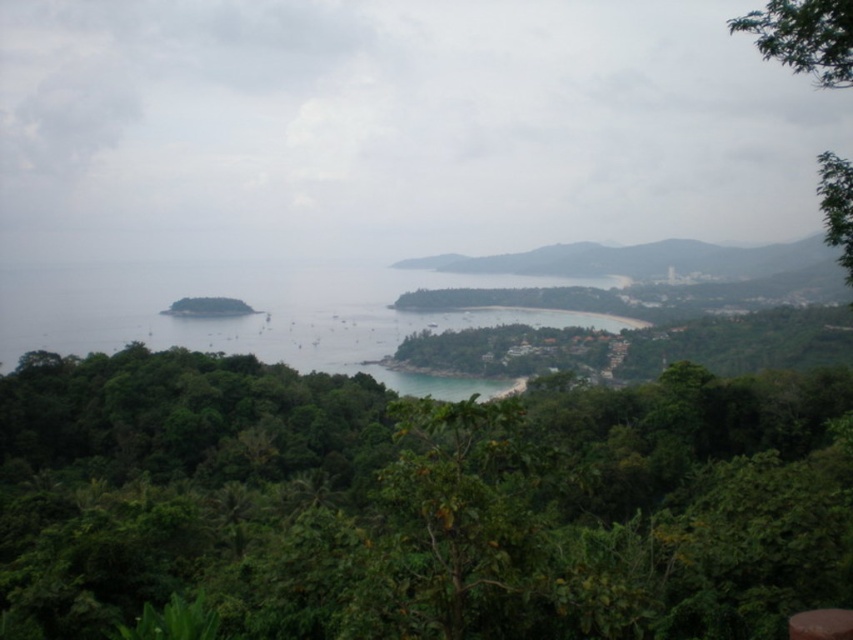
Does green leafy tree at center have a greater height compared to green leafy hillside at center?

In fact, green leafy tree at center may be shorter than green leafy hillside at center.

Does green leafy tree at center have a larger size compared to green leafy hillside at center?

No, green leafy tree at center is not bigger than green leafy hillside at center.

Is point (303, 605) closer to camera compared to point (645, 262)?

Yes, it is.

The image size is (853, 640). I want to click on green leafy tree at center, so click(x=418, y=502).

Between green leafy hillside at center and green leafy tree at upper right, which one appears on the left side from the viewer's perspective?

From the viewer's perspective, green leafy tree at upper right appears more on the left side.

Which of these two, green leafy hillside at center or green leafy tree at upper right, stands shorter?

green leafy hillside at center

Is point (827, 257) more distant than point (843, 29)?

That is True.

Identify the location of green leafy hillside at center. (637, 259).

Is the position of green leafy tree at center less distant than that of green leafy tree at upper right?

Yes, green leafy tree at center is closer to the viewer.

Measure the distance between point (383, 516) and camera.

The distance of point (383, 516) from camera is 83.65 meters.

Does point (784, 420) lie in front of point (827, 157)?

That is False.

Locate an element on the screen. The width and height of the screenshot is (853, 640). green leafy tree at center is located at coordinates (418, 502).